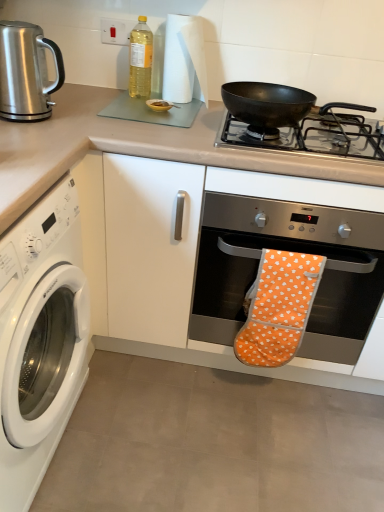
Where is `matte glass cutting board at upper center`? Image resolution: width=384 pixels, height=512 pixels. matte glass cutting board at upper center is located at coordinates 134,148.

This screenshot has width=384, height=512. In order to click on white glossy washing machine at left in this screenshot , I will do `click(40, 339)`.

The height and width of the screenshot is (512, 384). I want to click on matte glass cutting board at upper center, so click(x=134, y=148).

Looking at this image, which of these two, white paper towel at upper center or transparent plastic bottle at upper center, is bigger?

white paper towel at upper center.

Is white paper towel at upper center positioned behind transparent plastic bottle at upper center?

No, white paper towel at upper center is closer to the camera.

Who is shorter, white paper towel at upper center or transparent plastic bottle at upper center?

transparent plastic bottle at upper center is shorter.

From the image's perspective, would you say white paper towel at upper center is positioned over transparent plastic bottle at upper center?

No, from the image's perspective, white paper towel at upper center is not on top of transparent plastic bottle at upper center.

Does orange fabric oven mitt at center have a greater width compared to matte glass cutting board at upper center?

Incorrect, the width of orange fabric oven mitt at center does not surpass that of matte glass cutting board at upper center.

Is orange fabric oven mitt at center not within matte glass cutting board at upper center?

No, most part of orange fabric oven mitt at center lies within matte glass cutting board at upper center.

Is orange fabric oven mitt at center in contact with matte glass cutting board at upper center?

orange fabric oven mitt at center is not next to matte glass cutting board at upper center, and they're not touching.

Is white paper towel at upper center shorter than polished stainless steel kettle at upper left?

No.

Looking at this image, is white paper towel at upper center thinner than polished stainless steel kettle at upper left?

→ Indeed, white paper towel at upper center has a lesser width compared to polished stainless steel kettle at upper left.

Is white paper towel at upper center beside polished stainless steel kettle at upper left?

No, white paper towel at upper center is not touching polished stainless steel kettle at upper left.

Looking at the image, does white paper towel at upper center seem bigger or smaller compared to polished stainless steel kettle at upper left?

Considering their sizes, white paper towel at upper center takes up less space than polished stainless steel kettle at upper left.

Considering the relative positions of orange fabric oven mitt at center and white paper towel at upper center in the image provided, is orange fabric oven mitt at center to the right of white paper towel at upper center from the viewer's perspective?

Yes, orange fabric oven mitt at center is to the right of white paper towel at upper center.

Does orange fabric oven mitt at center have a smaller size compared to white paper towel at upper center?

Actually, orange fabric oven mitt at center might be larger than white paper towel at upper center.

From a real-world perspective, which is physically above, orange fabric oven mitt at center or white paper towel at upper center?

In real-world perspective, white paper towel at upper center is above.

Is polished stainless steel kettle at upper left facing away from orange fabric oven mitt at center?

No, orange fabric oven mitt at center is not at the back of polished stainless steel kettle at upper left.

Which object is wider, polished stainless steel kettle at upper left or orange fabric oven mitt at center?

orange fabric oven mitt at center.

Is polished stainless steel kettle at upper left not close to orange fabric oven mitt at center?

They are positioned close to each other.

Consider the image. From the image's perspective, between polished stainless steel kettle at upper left and orange fabric oven mitt at center, who is located below?

orange fabric oven mitt at center.

Is point (313, 130) closer to viewer compared to point (24, 225)?

That is False.

Is black matte pan at upper right not close to white glossy washing machine at left?

No, there isn't a large distance between black matte pan at upper right and white glossy washing machine at left.

From a real-world perspective, is black matte pan at upper right located higher than white glossy washing machine at left?

Yes, from a real-world perspective, black matte pan at upper right is over white glossy washing machine at left

Which of these two, black matte pan at upper right or white glossy washing machine at left, is bigger?

white glossy washing machine at left is bigger.

Who is smaller, polished stainless steel kettle at upper left or orange fabric oven mitt at center?

With smaller size is orange fabric oven mitt at center.

Considering the points (11, 108) and (285, 310), which point is behind, point (11, 108) or point (285, 310)?

The point (285, 310) is farther.

From the image's perspective, does polished stainless steel kettle at upper left appear higher than orange fabric oven mitt at center?

Correct, polished stainless steel kettle at upper left appears higher than orange fabric oven mitt at center in the image.

Consider the image. Is the position of polished stainless steel kettle at upper left less distant than that of orange fabric oven mitt at center?

Yes, the depth of polished stainless steel kettle at upper left is less than that of orange fabric oven mitt at center.

The image size is (384, 512). What are the coordinates of `paper towel above the transparent plastic bottle at upper center (from a real-world perspective)` in the screenshot? It's located at (184, 60).

I want to click on beach towel that is on the left side of matte glass cutting board at upper center, so click(279, 308).

Looking at the image, which one is located further to polished stainless steel kettle at upper left, white paper towel at upper center or black matte pan at upper right?

Based on the image, black matte pan at upper right appears to be further to polished stainless steel kettle at upper left.

Which object lies nearer to the anchor point transparent plastic bottle at upper center, orange fabric oven mitt at center or orange fabric oven mitt at center?

orange fabric oven mitt at center lies closer to transparent plastic bottle at upper center than the other object.

Looking at the image, which one is located further to matte glass cutting board at upper center, orange fabric oven mitt at center or orange fabric oven mitt at center?

The object further to matte glass cutting board at upper center is orange fabric oven mitt at center.

When comparing their distances from white paper towel at upper center, does transparent plastic bottle at upper center or black matte pan at upper right seem further?

Based on the image, black matte pan at upper right appears to be further to white paper towel at upper center.

Considering their positions, is white glossy washing machine at left positioned further to orange fabric oven mitt at center than white paper towel at upper center?

white paper towel at upper center is further to orange fabric oven mitt at center.

Which object lies nearer to the anchor point polished stainless steel kettle at upper left, transparent plastic bottle at upper center or orange fabric oven mitt at center?

Among the two, transparent plastic bottle at upper center is located nearer to polished stainless steel kettle at upper left.

Considering their positions, is white paper towel at upper center positioned further to white glossy washing machine at left than orange fabric oven mitt at center?

white paper towel at upper center is further to white glossy washing machine at left.

Considering their positions, is white glossy washing machine at left positioned closer to black matte pan at upper right than white paper towel at upper center?

The object closer to black matte pan at upper right is white paper towel at upper center.

You are a GUI agent. You are given a task and a screenshot of the screen. Output one action in this format:
    pyautogui.click(x=<x>, y=<y>)
    Task: Click on the oven that lies between white paper towel at upper center and white glossy washing machine at left from top to bottom
    
    Given the screenshot: What is the action you would take?
    pyautogui.click(x=293, y=251)

Where is `counter top between black matte pan at upper right and orange fabric oven mitt at center vertically`? Image resolution: width=384 pixels, height=512 pixels. counter top between black matte pan at upper right and orange fabric oven mitt at center vertically is located at coordinates (134, 148).

The image size is (384, 512). Find the location of `gas stove between white paper towel at upper center and orange fabric oven mitt at center from top to bottom`. gas stove between white paper towel at upper center and orange fabric oven mitt at center from top to bottom is located at coordinates (313, 135).

Locate an element on the screen. oven between white glossy washing machine at left and black matte pan at upper right in the horizontal direction is located at coordinates (293, 251).